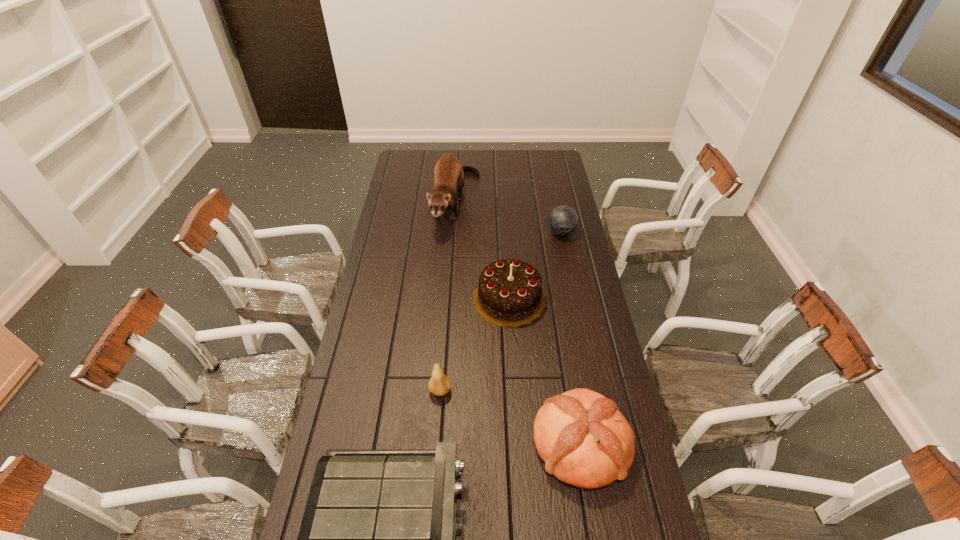
This screenshot has height=540, width=960. Find the location of `empty location between the birthday cake and the pear`. empty location between the birthday cake and the pear is located at coordinates (474, 345).

This screenshot has width=960, height=540. I want to click on vacant space that's between the bread and the third farthest object, so click(x=545, y=371).

Image resolution: width=960 pixels, height=540 pixels. I want to click on unoccupied area between the bowling ball and the bread, so click(x=571, y=338).

Locate an element on the screen. The image size is (960, 540). free space between the pear and the fifth shortest object is located at coordinates (474, 345).

Find the location of a particular element. This screenshot has height=540, width=960. free area in between the bowling ball and the bread is located at coordinates (571, 338).

Select which object is the closest to the bread. Please provide its 2D coordinates. Your answer should be formatted as a tuple, i.e. [(x, y)], where the tuple contains the x and y coordinates of a point satisfying the conditions above.

[(378, 536)]

Identify the location of object that stands as the closest to the bowling ball. Image resolution: width=960 pixels, height=540 pixels. (510, 293).

At what (x,y) coordinates should I click in order to perform the action: click on free spot that satisfies the following two spatial constraints: 1. at the face of the fourth nearest object; 2. on the right side of the ferret. Please return your answer as a coordinate pair (x, y). Looking at the image, I should click on (449, 299).

Locate an element on the screen. Image resolution: width=960 pixels, height=540 pixels. free point that satisfies the following two spatial constraints: 1. at the face of the tallest object; 2. on the right side of the bread is located at coordinates (440, 443).

The width and height of the screenshot is (960, 540). I want to click on free point that satisfies the following two spatial constraints: 1. at the face of the bread; 2. on the right side of the ferret, so click(x=440, y=443).